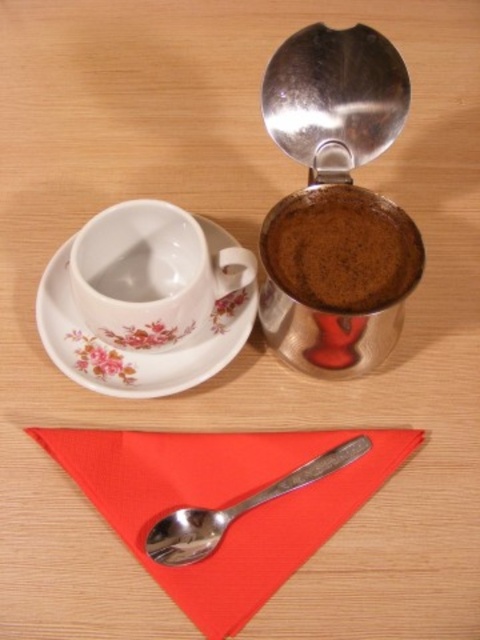
Question: Does red fabric napkin at lower center appear over silver metallic spoon at lower center?

Choices:
 (A) no
 (B) yes

Answer: (A)

Question: Which point is closer to the camera?

Choices:
 (A) dark brown ground coffee at upper right
 (B) silver metallic spoon at lower center
 (C) porcelain floral saucer at upper left

Answer: (A)

Question: Is red fabric napkin at lower center to the left of silver metallic spoon at lower center from the viewer's perspective?

Choices:
 (A) no
 (B) yes

Answer: (B)

Question: Is porcelain floral saucer at upper left smaller than silver metallic spoon at lower center?

Choices:
 (A) yes
 (B) no

Answer: (B)

Question: Which of the following is the farthest from the observer?

Choices:
 (A) porcelain floral saucer at upper left
 (B) red fabric napkin at lower center
 (C) shiny metallic coffee grinder at upper right

Answer: (A)

Question: Which point is farther to the camera?

Choices:
 (A) (386, 236)
 (B) (367, 436)
 (C) (98, 385)

Answer: (C)